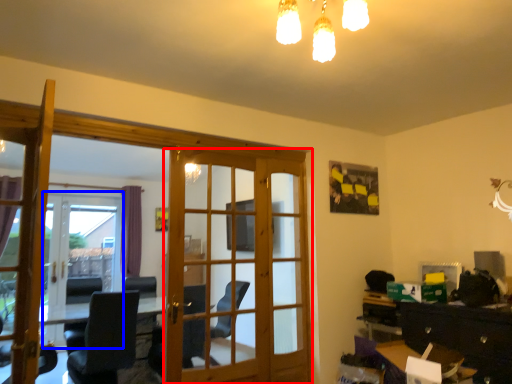
Question: Which object is closer to the camera taking this photo, door (highlighted by a red box) or screen door (highlighted by a blue box)?

Choices:
 (A) door
 (B) screen door

Answer: (A)